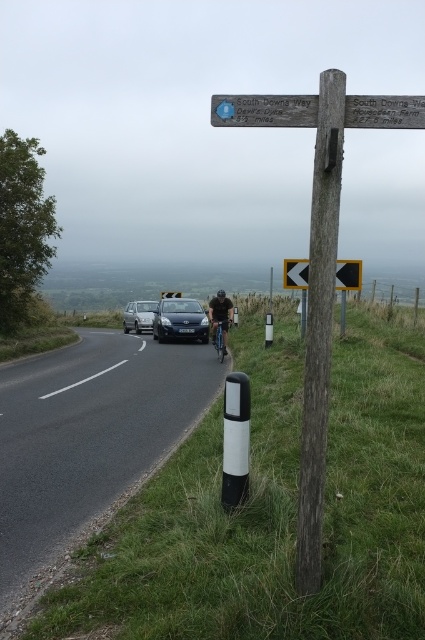
Does wooden post at center appear on the left side of silver metallic car at center?

No, wooden post at center is not to the left of silver metallic car at center.

This screenshot has height=640, width=425. Describe the element at coordinates (319, 324) in the screenshot. I see `wooden post at center` at that location.

What do you see at coordinates (319, 324) in the screenshot? The width and height of the screenshot is (425, 640). I see `wooden post at center` at bounding box center [319, 324].

The image size is (425, 640). In order to click on wooden post at center in this screenshot , I will do pyautogui.click(x=319, y=324).

Does silver metallic car at center have a smaller size compared to blue metallic bicycle at center?

No, silver metallic car at center is not smaller than blue metallic bicycle at center.

Where is `silver metallic car at center`? This screenshot has width=425, height=640. silver metallic car at center is located at coordinates (138, 316).

Between shiny metallic car at center and silver metallic car at center, which one appears on the left side from the viewer's perspective?

Positioned to the left is silver metallic car at center.

Where is `shiny metallic car at center`? This screenshot has width=425, height=640. shiny metallic car at center is located at coordinates (180, 321).

Where is `shiny metallic car at center`? This screenshot has height=640, width=425. shiny metallic car at center is located at coordinates (180, 321).